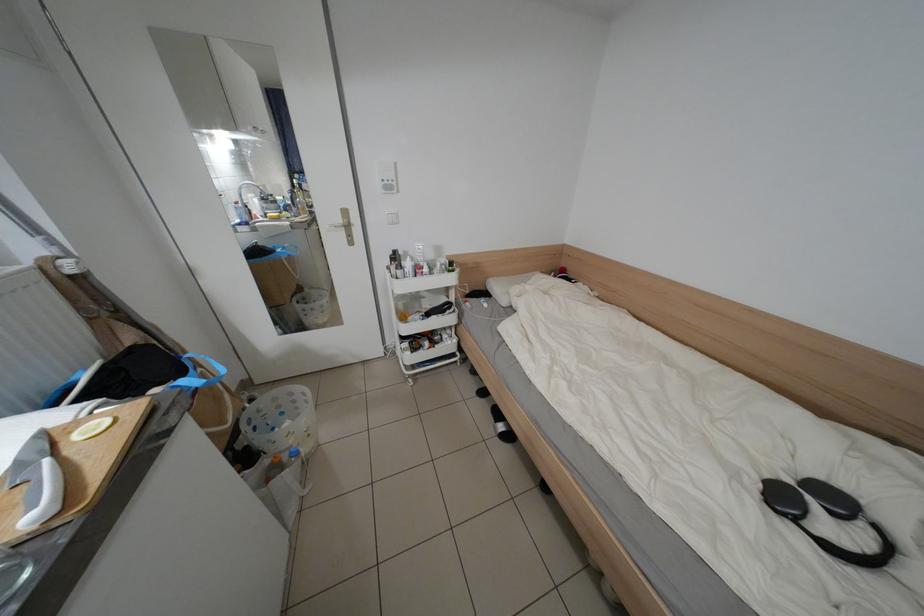
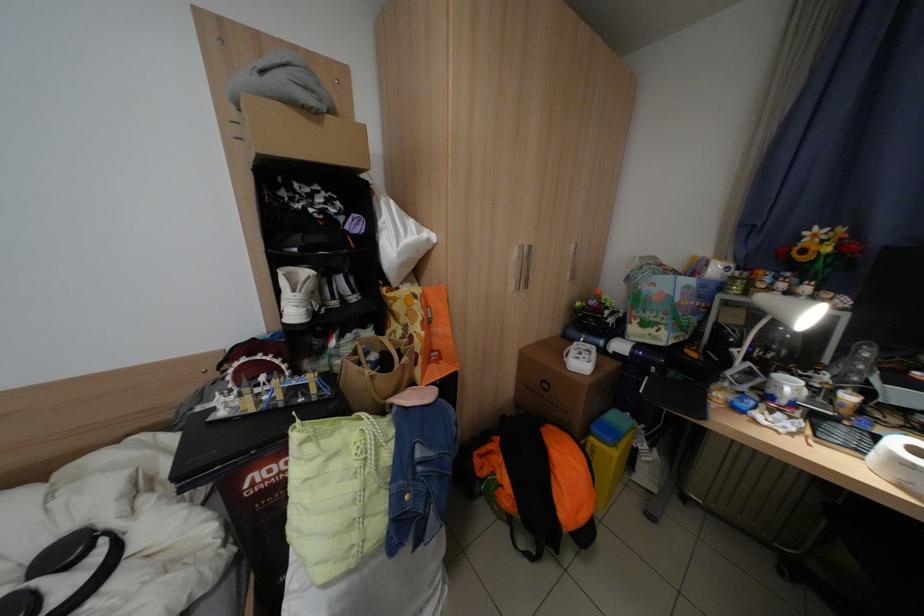
The point at (801, 482) is marked in the first image. Where is the corresponding point in the second image?

(17, 593)